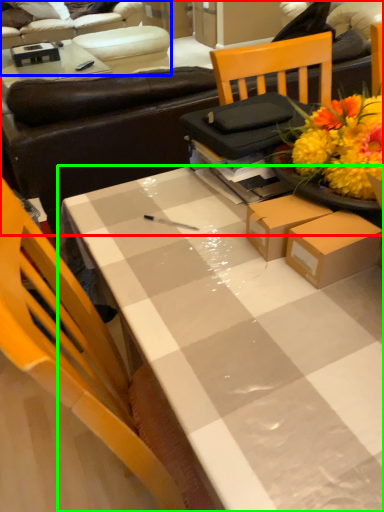
Question: Based on their relative distances, which object is nearer to studio couch (highlighted by a red box)? Choose from studio couch (highlighted by a blue box) and desk (highlighted by a green box).

Choices:
 (A) studio couch
 (B) desk

Answer: (B)